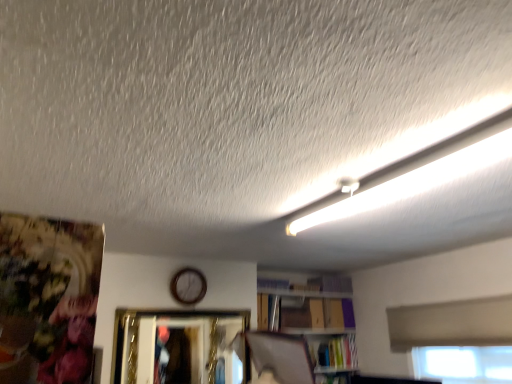
Question: Based on their sizes in the image, would you say wooden clock at center is bigger or smaller than hardcover book at lower right?

Choices:
 (A) small
 (B) big

Answer: (A)

Question: Is wooden clock at center to the left or to the right of hardcover book at lower right in the image?

Choices:
 (A) left
 (B) right

Answer: (A)

Question: Estimate the real-world distances between objects in this image. Which object is farther from the wooden clock at center?

Choices:
 (A) white fluorescent tube at upper right
 (B) hardcover book at lower right
 (C) gold metallic picture frame at center

Answer: (A)

Question: Which object is the farthest from the hardcover book at lower right?

Choices:
 (A) wooden clock at center
 (B) white fluorescent tube at upper right
 (C) gold metallic picture frame at center

Answer: (B)